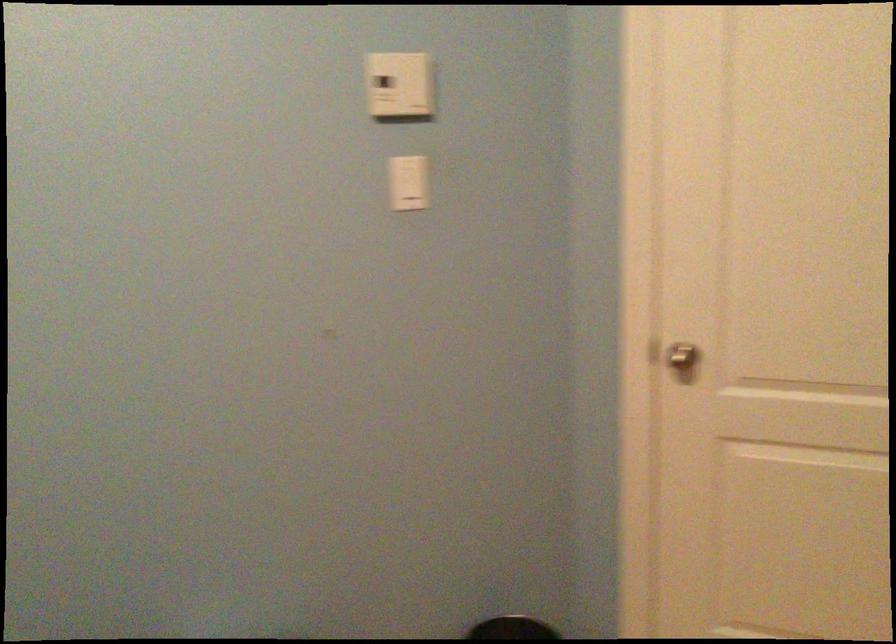
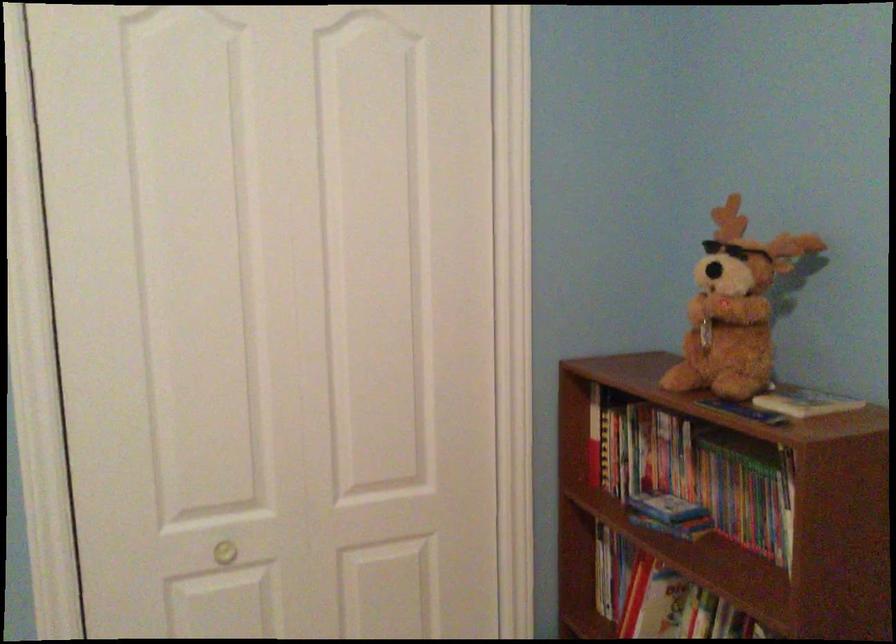
Question: How did the camera likely rotate?

Choices:
 (A) Left
 (B) Right
 (C) Up
 (D) Down

Answer: (B)